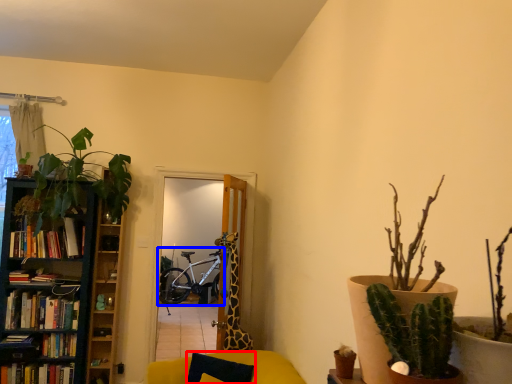
Question: Which object is closer to the camera taking this photo, pillow (highlighted by a red box) or bicycle (highlighted by a blue box)?

Choices:
 (A) pillow
 (B) bicycle

Answer: (A)